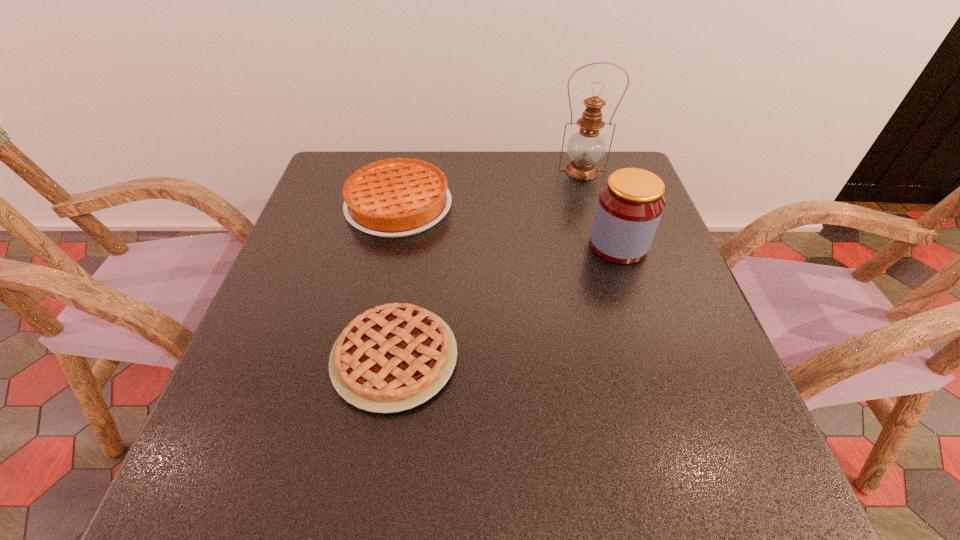
This screenshot has width=960, height=540. I want to click on oil lamp, so click(x=586, y=147).

Locate an element on the screen. This screenshot has height=540, width=960. jar is located at coordinates (629, 208).

In order to click on the second shortest object in this screenshot , I will do `click(391, 198)`.

The image size is (960, 540). I want to click on the taller pie, so click(x=391, y=198).

What are the coordinates of `the shorter pie` in the screenshot? It's located at (391, 358).

Find the location of `the nearest object`. the nearest object is located at coordinates (391, 358).

Where is `blank space located 0.230m on the left of the tallest object`? This screenshot has width=960, height=540. blank space located 0.230m on the left of the tallest object is located at coordinates (474, 170).

I want to click on vacant space located 0.290m on the back of the third shortest object, so click(591, 162).

Locate an element on the screen. This screenshot has width=960, height=540. free space located 0.080m on the right of the taller pie is located at coordinates (483, 206).

Locate an element on the screen. vacant space located on the right of the nearest object is located at coordinates (604, 357).